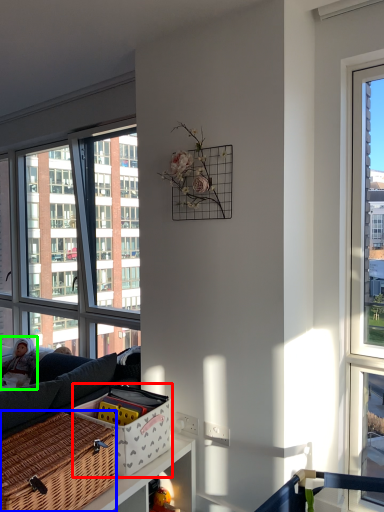
Question: Estimate the real-world distances between objects in this image. Which object is closer to basket (highlighted by a red box), picnic basket (highlighted by a blue box) or couple (highlighted by a green box)?

Choices:
 (A) picnic basket
 (B) couple

Answer: (A)